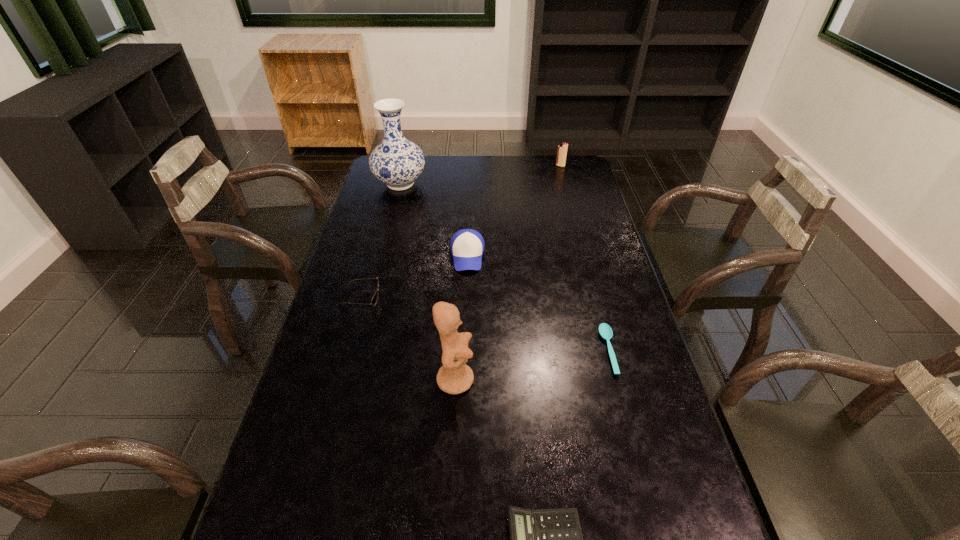
At what (x,y) coordinates should I click in order to perform the action: click on vase. Please return your answer as a coordinate pair (x, y). Looking at the image, I should click on (397, 162).

You are a GUI agent. You are given a task and a screenshot of the screen. Output one action in this format:
    pyautogui.click(x=<x>, y=<y>)
    Task: Click on the tallest object
    
    Given the screenshot: What is the action you would take?
    pyautogui.click(x=397, y=162)

Where is `the second tallest object`? This screenshot has height=540, width=960. the second tallest object is located at coordinates (454, 377).

You are a GUI agent. You are given a task and a screenshot of the screen. Output one action in this format:
    pyautogui.click(x=<x>, y=<y>)
    Task: Click on the igniter
    The width and height of the screenshot is (960, 540).
    Given the screenshot: What is the action you would take?
    pyautogui.click(x=562, y=148)

This screenshot has width=960, height=540. Identify the location of the farthest object. (562, 148).

Locate an element on the screen. The width and height of the screenshot is (960, 540). baseball cap is located at coordinates (467, 245).

The height and width of the screenshot is (540, 960). Find the location of `the third farthest object`. the third farthest object is located at coordinates tap(467, 245).

Where is `the fourth nearest object`? The height and width of the screenshot is (540, 960). the fourth nearest object is located at coordinates (375, 298).

I want to click on spoon, so click(605, 330).

Where is `blank area located 0.260m on the right of the sixth nearest object`? Image resolution: width=960 pixels, height=540 pixels. blank area located 0.260m on the right of the sixth nearest object is located at coordinates (491, 184).